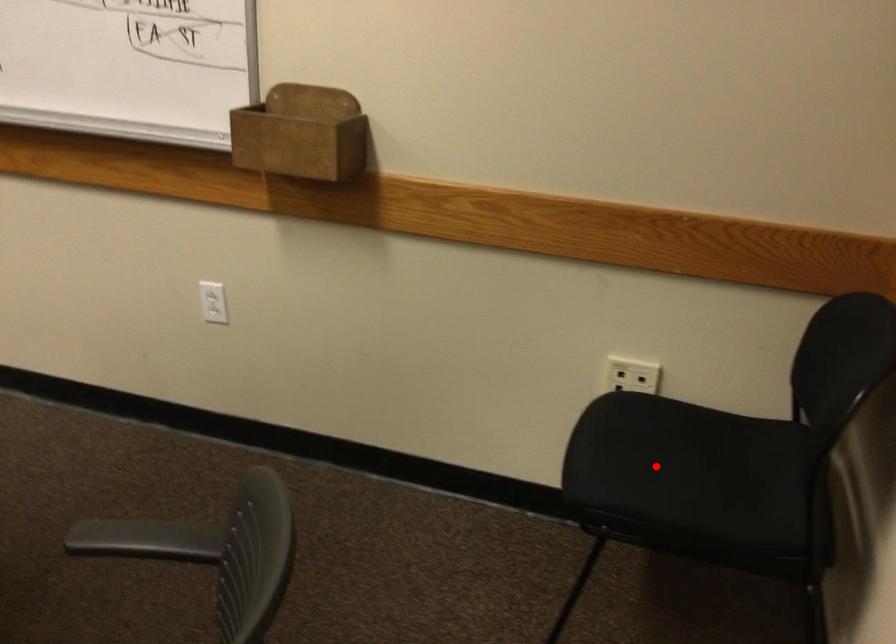
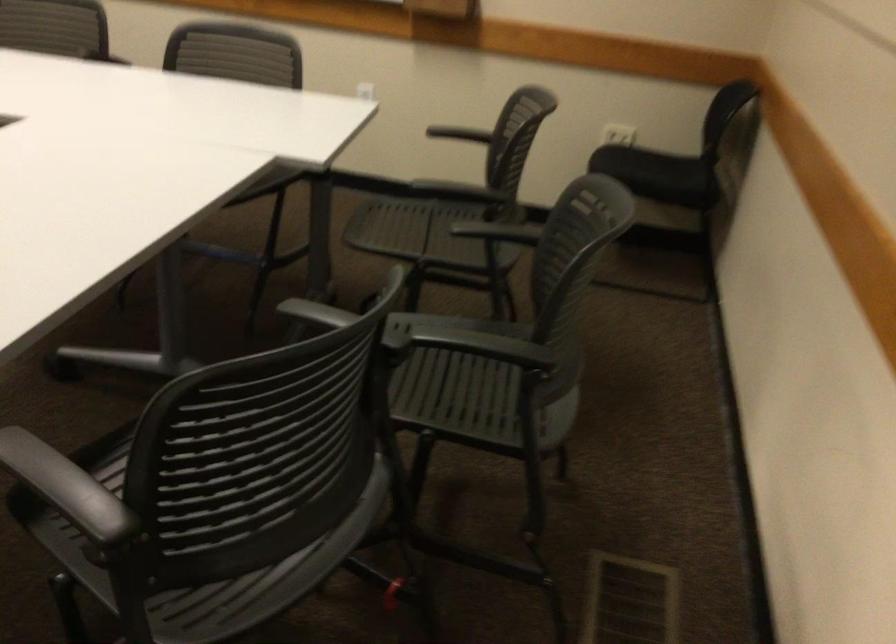
Question: I am providing you with two images of the same scene from different viewpoints. Given a red point in image1, look at the same physical point in image2. Is it:

Choices:
 (A) Closer to the viewpoint
 (B) Farther from the viewpoint

Answer: (B)